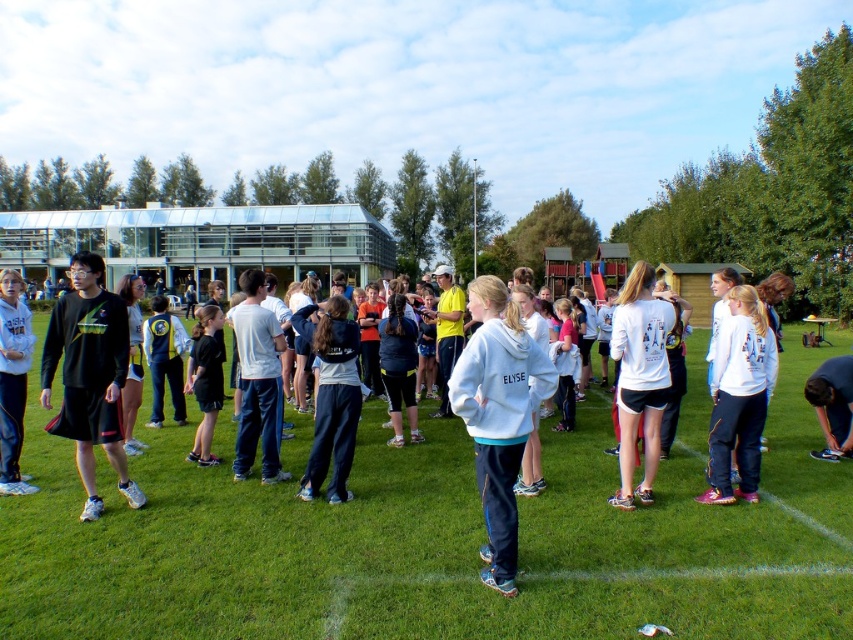
From the picture: You are standing in the middle of the grassy field and want to take a photo of the two points marked in the image. Which point, point (x=42, y=364) or point (x=196, y=340), will appear larger in your photo?

Point (x=42, y=364) will appear larger in the photo because it is closer to the camera than point (x=196, y=340).

You are organizing a picnic and need to place a picnic basket on the green grass at center. However, there is a white fleece jacket at center in the way. Can you fit the basket there without moving the jacket?

The green grass at center might be wider than the white fleece jacket at center, so there could be enough space to place the picnic basket without moving the jacket.